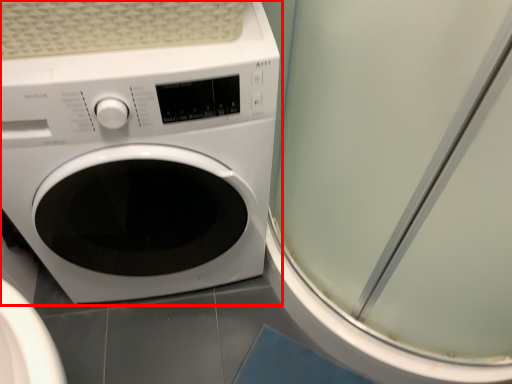
Question: From the image's perspective, where is washing machine (annotated by the red box) located in relation to screen door in the image?

Choices:
 (A) above
 (B) below

Answer: (B)